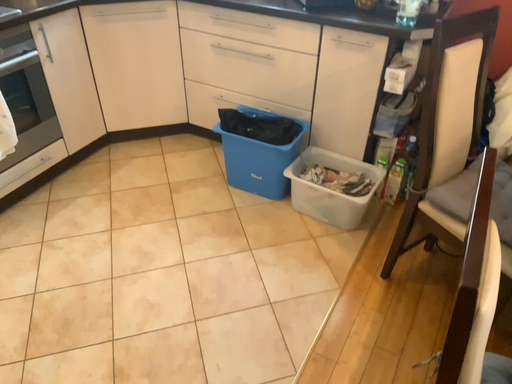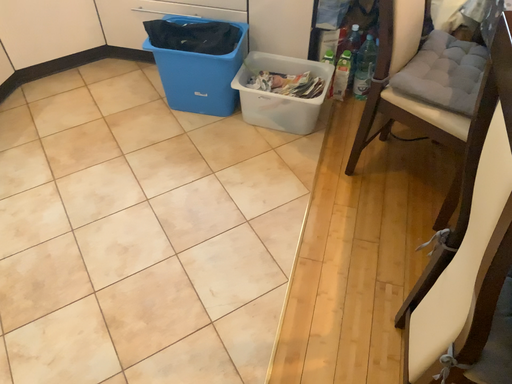
Question: How did the camera likely rotate when shooting the video?

Choices:
 (A) rotated downward
 (B) rotated upward

Answer: (A)